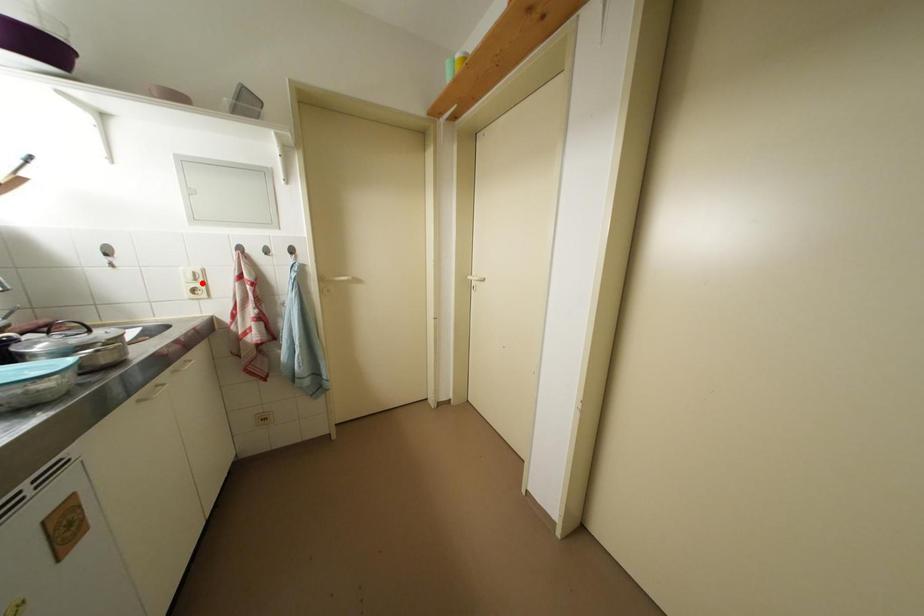
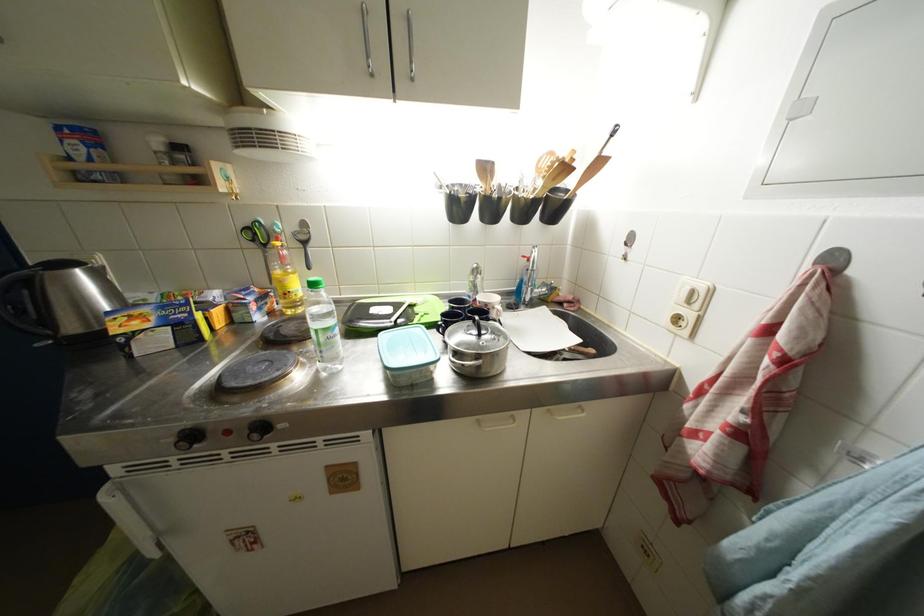
Locate, in the second image, the point that corresponds to the highlighted location in the first image.

(696, 306)